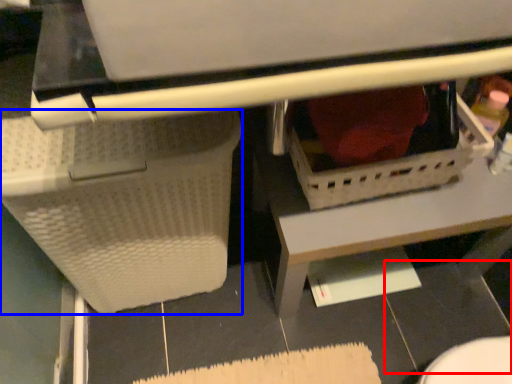
Question: Which point is further to the camera, tile (highlighted by a red box) or basket (highlighted by a blue box)?

Choices:
 (A) tile
 (B) basket

Answer: (A)